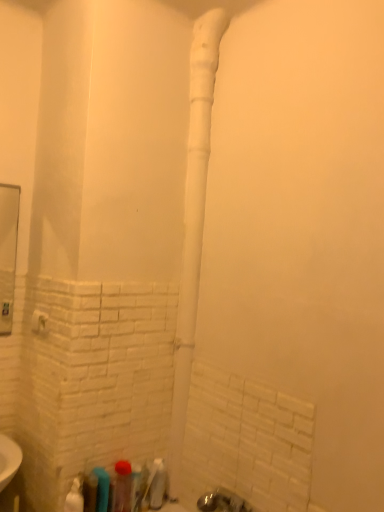
Question: Does point (41, 331) appear closer or farther from the camera than point (74, 507)?

Choices:
 (A) farther
 (B) closer

Answer: (A)

Question: Choose the correct answer: Is white plastic towel bar at lower left inside white glossy spray bottle at lower left, the 1th toiletry positioned from the left, or outside it?

Choices:
 (A) outside
 (B) inside

Answer: (A)

Question: Estimate the real-world distances between objects in this image. Which object is closer to the translucent plastic bottle at lower left, the 4th toiletry when ordered from right to left?

Choices:
 (A) white glossy spray bottle at lower left, which is counted as the sixth toiletry, starting from the right
 (B) translucent plastic toothbrush at lower center, the fifth toiletry viewed from the left
 (C) translucent plastic bottle at lower left, which is counted as the second toiletry, starting from the left
 (D) white plastic towel bar at lower left
 (E) translucent plastic bottle at lower center, which is the fourth toiletry from left to right

Answer: (C)

Question: Based on their relative distances, which object is nearer to the white glossy spray bottle at lower left, which is counted as the sixth toiletry, starting from the right?

Choices:
 (A) white plastic towel bar at lower left
 (B) translucent plastic toothbrush at lower center, the fifth toiletry viewed from the left
 (C) translucent plastic bottle at lower left, the 4th toiletry when ordered from right to left
 (D) translucent plastic bottle at lower center, which ranks as the sixth toiletry in left-to-right order
 (E) translucent plastic bottle at lower left, which is counted as the second toiletry, starting from the left

Answer: (E)